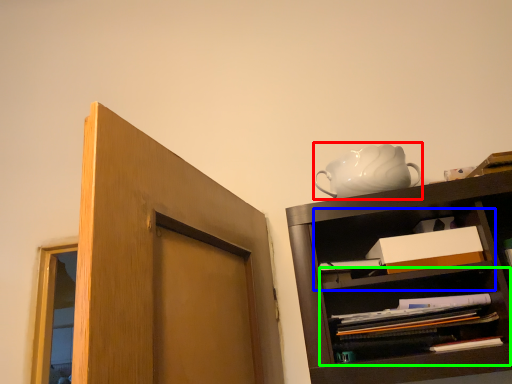
Question: Based on their relative distances, which object is nearer to tea pot (highlighted by a red box)? Choose from cabinet (highlighted by a blue box) and shelf (highlighted by a green box).

Choices:
 (A) cabinet
 (B) shelf

Answer: (A)